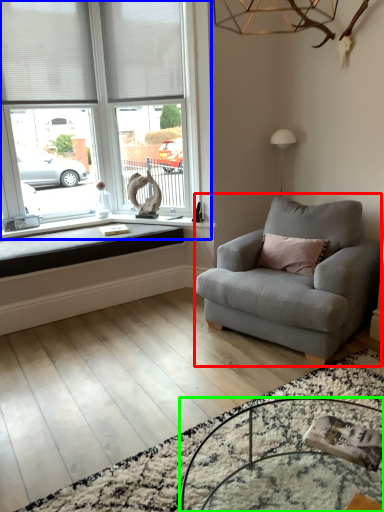
Question: Which object is the closest to the studio couch (highlighted by a red box)? Choose among these: window (highlighted by a blue box) or table (highlighted by a green box).

Choices:
 (A) window
 (B) table

Answer: (B)